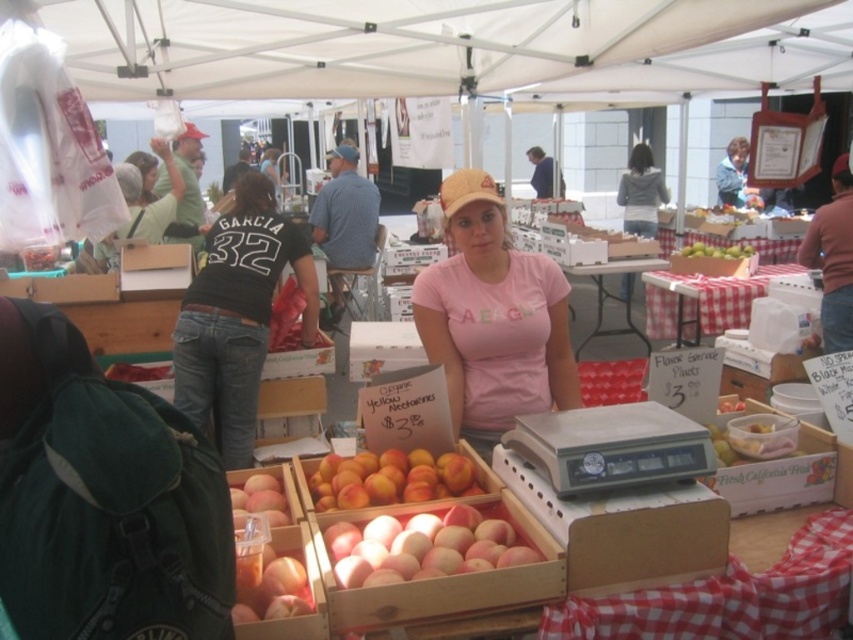
You are standing at the farmer market and want to take a photo of the two points mentioned. Which point, point (x=408, y=467) or point (x=744, y=250), will appear larger in your camera view?

Point (x=408, y=467) is closer to the viewer than point (x=744, y=250), so it will appear larger in the camera view.